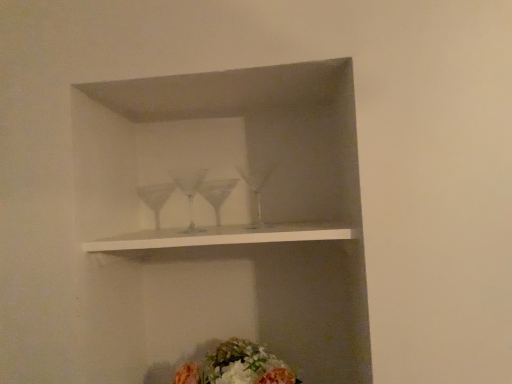
Question: From the image's perspective, is fluffy floral bouquet at lower center located above or below white matte shelf at center?

Choices:
 (A) below
 (B) above

Answer: (A)

Question: Is fluffy floral bouquet at lower center in front of or behind white matte shelf at center in the image?

Choices:
 (A) behind
 (B) front

Answer: (A)

Question: Is point (218, 362) closer or farther from the camera than point (155, 243)?

Choices:
 (A) farther
 (B) closer

Answer: (A)

Question: In the image, is white matte shelf at center positioned in front of or behind fluffy floral bouquet at lower center?

Choices:
 (A) behind
 (B) front

Answer: (B)

Question: Is white matte shelf at center taller or shorter than fluffy floral bouquet at lower center?

Choices:
 (A) short
 (B) tall

Answer: (A)

Question: Is point (168, 240) closer or farther from the camera than point (266, 377)?

Choices:
 (A) closer
 (B) farther

Answer: (A)

Question: In terms of size, does white matte shelf at center appear bigger or smaller than fluffy floral bouquet at lower center?

Choices:
 (A) big
 (B) small

Answer: (B)